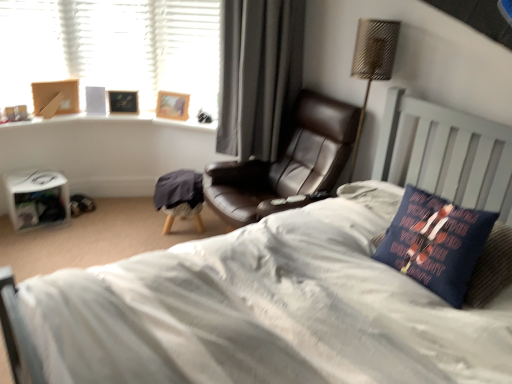
This screenshot has height=384, width=512. In order to click on vacant area located to the right-hand side of wooden picture frame at upper left, the 1th picture frame when ordered from left to right in this screenshot , I will do `click(143, 115)`.